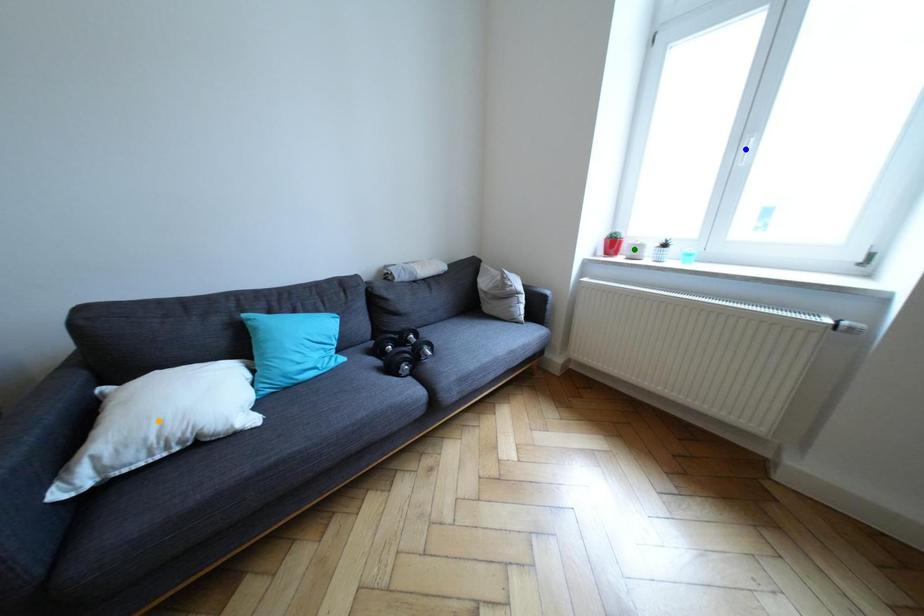
Order these from nearest to farthest:
green point | blue point | orange point

green point < blue point < orange point